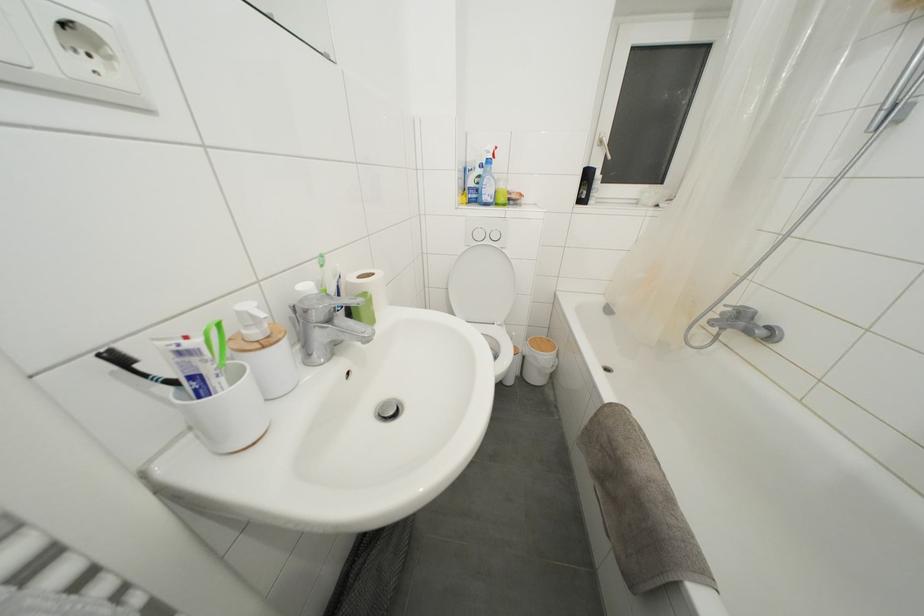
Find where to lift the silver faucet handle. Please return your answer as a coordinate pair (x, y).

(322, 306)